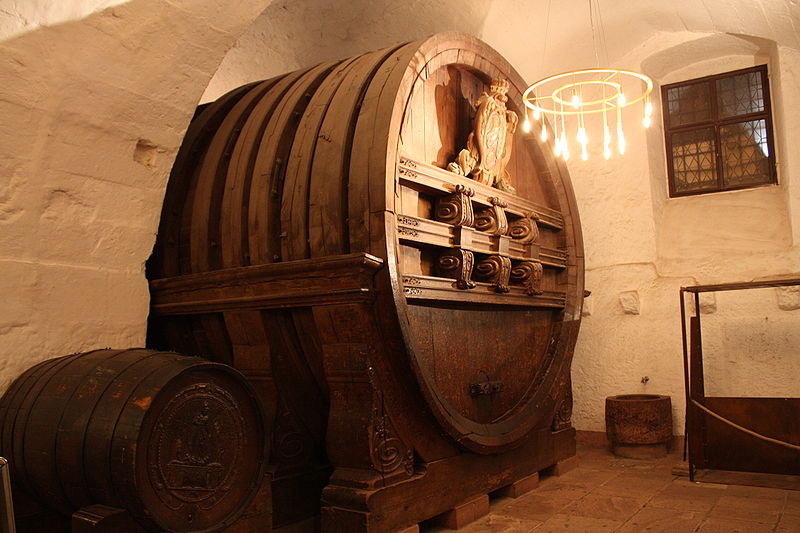
In order to click on white ceiling in this screenshot , I will do `click(362, 20)`.